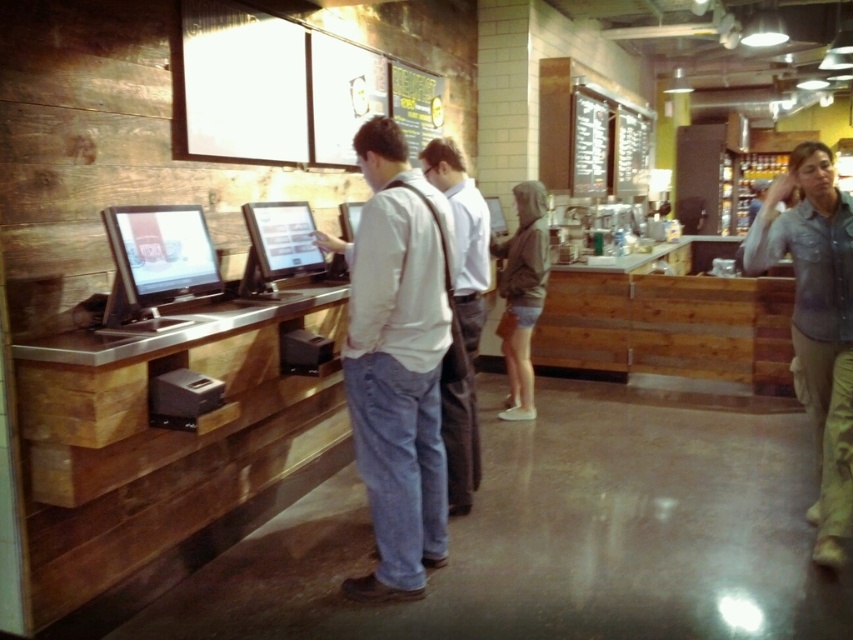
You are a customer at this counter and want to ask the person in the white cotton shirt at center for help. Which direction should you turn to face them if you are currently facing the denim shirt at center?

The white cotton shirt at center is to the left of the denim shirt at center, so you should turn to your left to face them.

You are a customer at the counter and want to place an order using the matte black touchscreen at center. Where should you position yourself relative to the white cotton shirt at center to access the touchscreen?

The white cotton shirt at center is below the matte black touchscreen at center, so you should position yourself above the white cotton shirt at center to reach the touchscreen.

You are a customer at the counter and want to know which of the two shirts is narrower. The scene has a white cotton shirt at center and a denim shirt at center. Can you determine which one is narrower?

The white cotton shirt at center is narrower than the denim shirt at center according to the description.